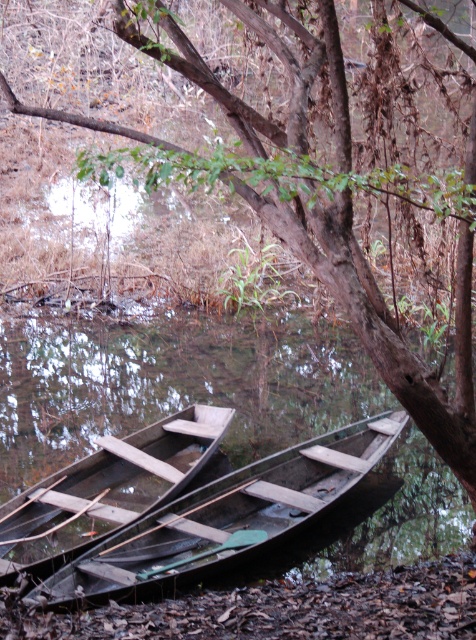
You are standing at the edge of the waterway and want to take a photo of the dark brown wooden boat at lower center. If your camera has a maximum zoom range of 4 meters, will you be able to capture the boat clearly without moving closer?

The dark brown wooden boat at lower center is 5.06 meters away from the camera. Since the camera can only zoom up to 4 meters, you won cannot capture the boat clearly without moving closer.